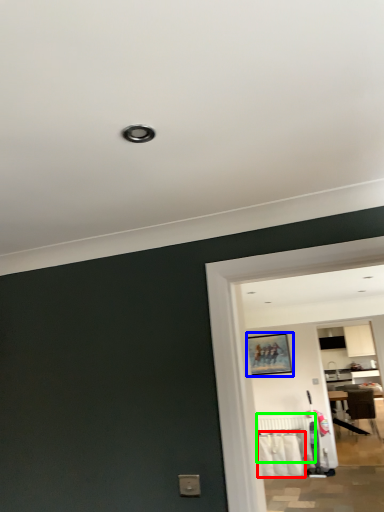
Question: Estimate the real-world distances between objects in this image. Which object is closer to laundry (highlighted by a red box), picture frame (highlighted by a blue box) or radiator (highlighted by a green box)?

Choices:
 (A) picture frame
 (B) radiator

Answer: (B)